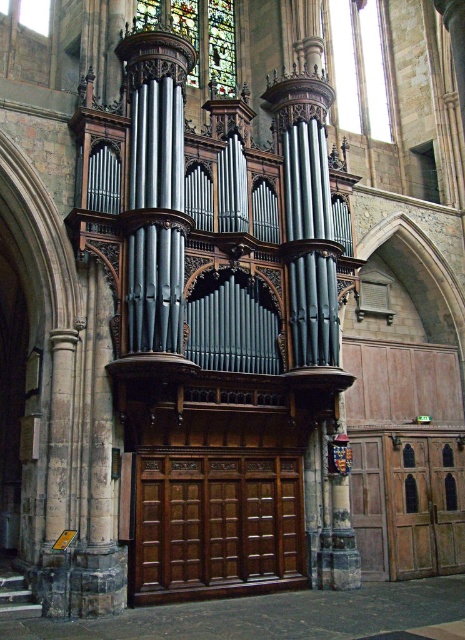
Question: Can you confirm if clear glass at upper center is bigger than stained glass at upper center?

Choices:
 (A) no
 (B) yes

Answer: (A)

Question: Can you confirm if clear glass at upper center is thinner than stained glass at upper center?

Choices:
 (A) yes
 (B) no

Answer: (A)

Question: Which point appears farthest from the camera in this image?

Choices:
 (A) (366, 116)
 (B) (207, 68)

Answer: (A)

Question: Is clear glass at upper center smaller than stained glass at upper center?

Choices:
 (A) no
 (B) yes

Answer: (B)